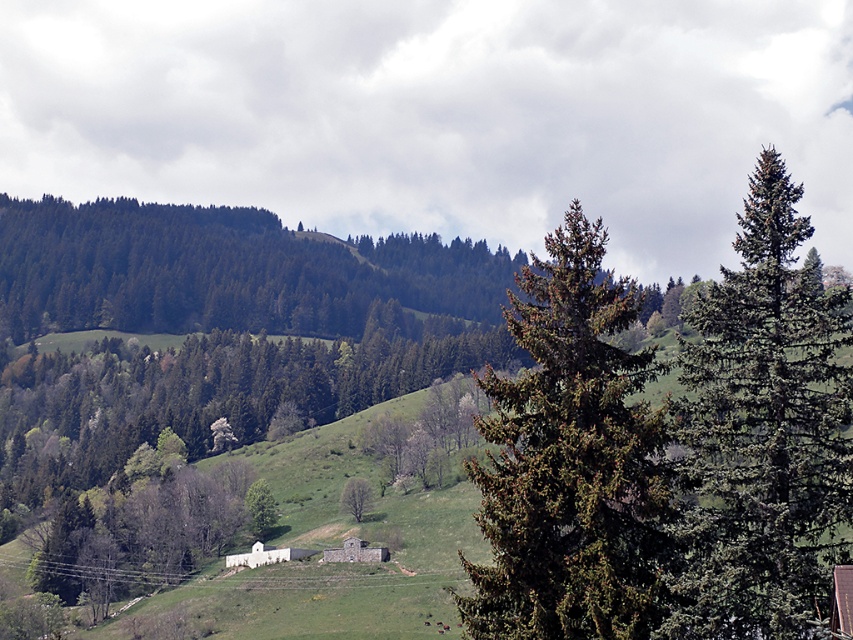
Question: Which object is positioned closest to the green matte tree at center?

Choices:
 (A) green needle-like tree at right
 (B) green needle-like tree at center

Answer: (B)

Question: Does green needle-like tree at right lie behind green matte tree at center?

Choices:
 (A) yes
 (B) no

Answer: (B)

Question: In this image, where is green needle-like tree at center located relative to green matte tree at lower left?

Choices:
 (A) right
 (B) left

Answer: (A)

Question: Estimate the real-world distances between objects in this image. Which object is closer to the green needle-like tree at right?

Choices:
 (A) green needle-like tree at center
 (B) green matte tree at lower left

Answer: (A)

Question: Is green needle-like tree at right bigger than green matte tree at center?

Choices:
 (A) yes
 (B) no

Answer: (A)

Question: Estimate the real-world distances between objects in this image. Which object is closer to the green needle-like tree at right?

Choices:
 (A) green matte tree at lower left
 (B) green needle-like tree at center

Answer: (B)